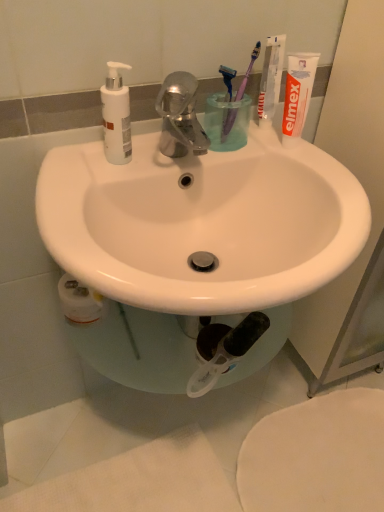
At what (x,y) coordinates should I click in order to perform the action: click on vacant position to the left of white matte bidet at lower right. Please return your answer as a coordinate pair (x, y). Looking at the image, I should click on (177, 440).